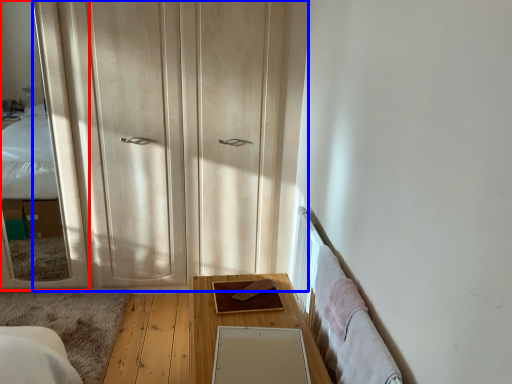
Question: Which object is further to the camera taking this photo, mirror (highlighted by a red box) or dresser (highlighted by a blue box)?

Choices:
 (A) mirror
 (B) dresser

Answer: (B)